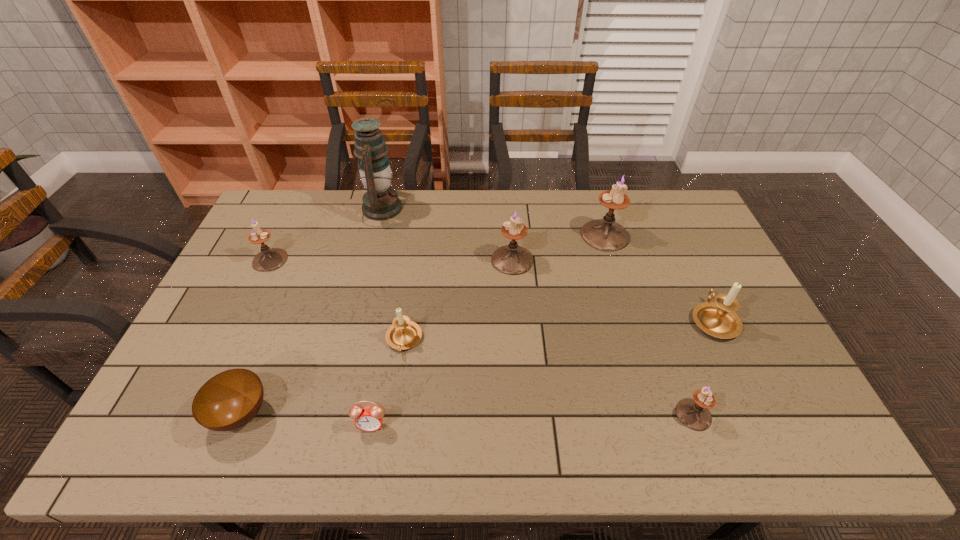
Image resolution: width=960 pixels, height=540 pixels. Identify the location of free space between the rightmost candle holder and the nearest candle holder. (704, 367).

You are a GUI agent. You are given a task and a screenshot of the screen. Output one action in this format:
    pyautogui.click(x=<x>, y=<y>)
    Task: Click on the free space between the oil lamp and the bowl
    The width and height of the screenshot is (960, 540).
    Given the screenshot: What is the action you would take?
    (x=310, y=311)

The image size is (960, 540). Identify the location of vacant space that's between the alarm clock and the nearest candle holder. (533, 420).

You are a GUI agent. You are given a task and a screenshot of the screen. Output one action in this format:
    pyautogui.click(x=<x>, y=<y>)
    Task: Click on the free area in between the smaller beige candle holder and the bowl
    The width and height of the screenshot is (960, 540).
    Given the screenshot: What is the action you would take?
    pyautogui.click(x=323, y=377)

Locate an element on the screen. The height and width of the screenshot is (540, 960). empty space between the fifth candle holder from right to left and the shortest object is located at coordinates (323, 377).

Image resolution: width=960 pixels, height=540 pixels. I want to click on vacant area that lies between the second smallest purple candle holder and the alarm clock, so click(321, 342).

The width and height of the screenshot is (960, 540). I want to click on blank region between the right beige candle holder and the rust oil lamp, so click(x=547, y=264).

This screenshot has height=540, width=960. Find the location of `free space between the bigger beige candle holder and the smallest purple candle holder`. free space between the bigger beige candle holder and the smallest purple candle holder is located at coordinates (704, 367).

This screenshot has width=960, height=540. I want to click on vacant region between the bigger beige candle holder and the tallest candle holder, so tap(660, 278).

At what (x,y) coordinates should I click in order to perform the action: click on unoccupied position between the tallest candle holder and the shortest object. Please return your answer as a coordinate pair (x, y). This screenshot has height=540, width=960. Looking at the image, I should click on (423, 325).